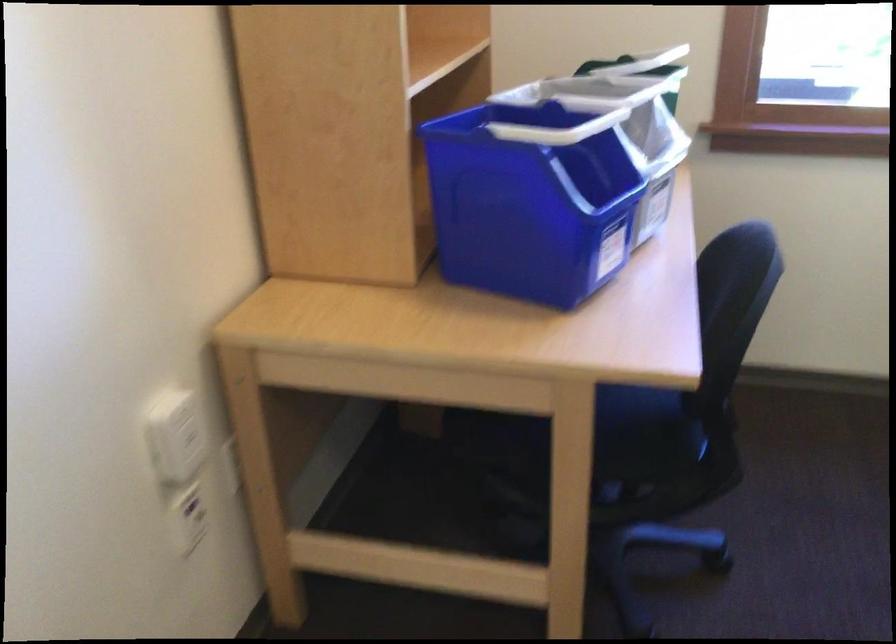
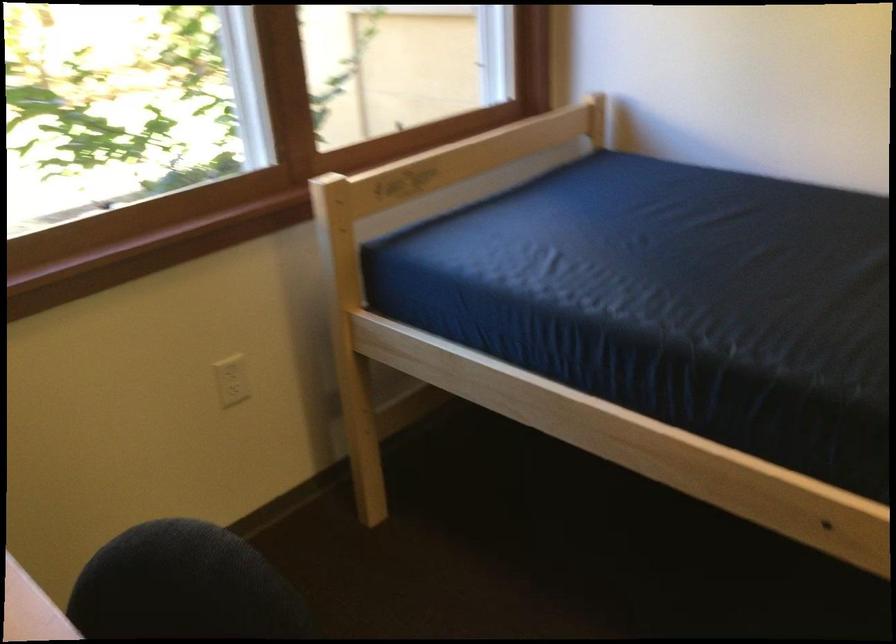
Question: The camera is either moving clockwise (left) or counter-clockwise (right) around the object. The first image is from the beginning of the video and the second image is from the end. Is the camera moving left or right when shooting the video?

Choices:
 (A) Left
 (B) Right

Answer: (A)